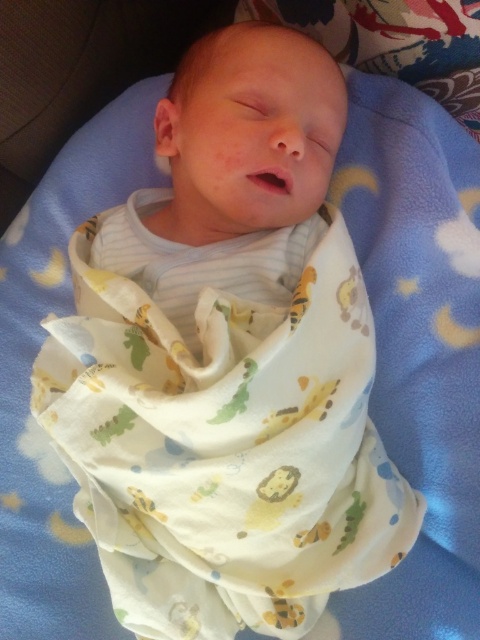
Is point (116, 298) closer to camera compared to point (190, 198)?

Yes, point (116, 298) is in front of point (190, 198).

The width and height of the screenshot is (480, 640). Find the location of `white fabric with animal prints at center`. white fabric with animal prints at center is located at coordinates (225, 448).